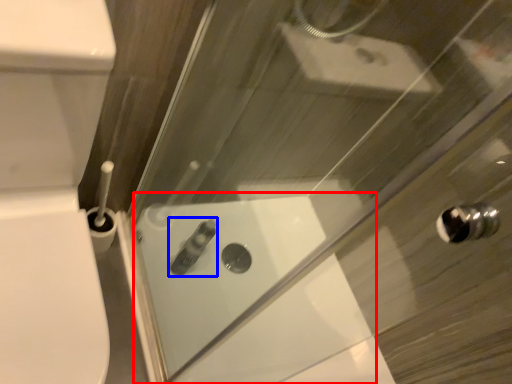
Question: Which point is further to the camera, bath (highlighted by a red box) or toiletry (highlighted by a blue box)?

Choices:
 (A) bath
 (B) toiletry

Answer: (B)